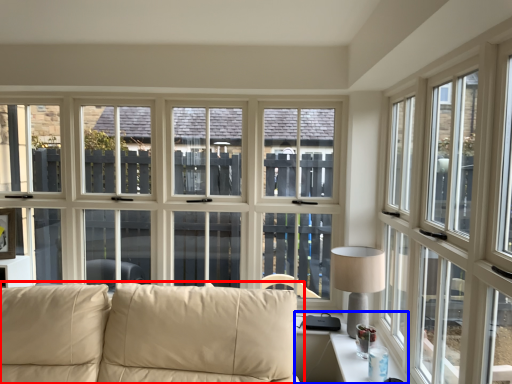
Question: Among these objects, which one is farthest to the camera, studio couch (highlighted by a red box) or table (highlighted by a blue box)?

Choices:
 (A) studio couch
 (B) table

Answer: (B)